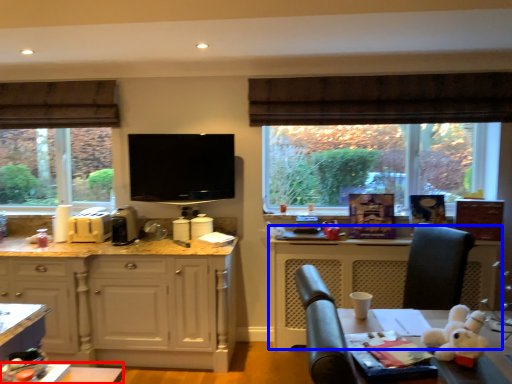
Question: Among these objects, which one is farthest to the camera, table (highlighted by a red box) or counter (highlighted by a blue box)?

Choices:
 (A) table
 (B) counter

Answer: (B)